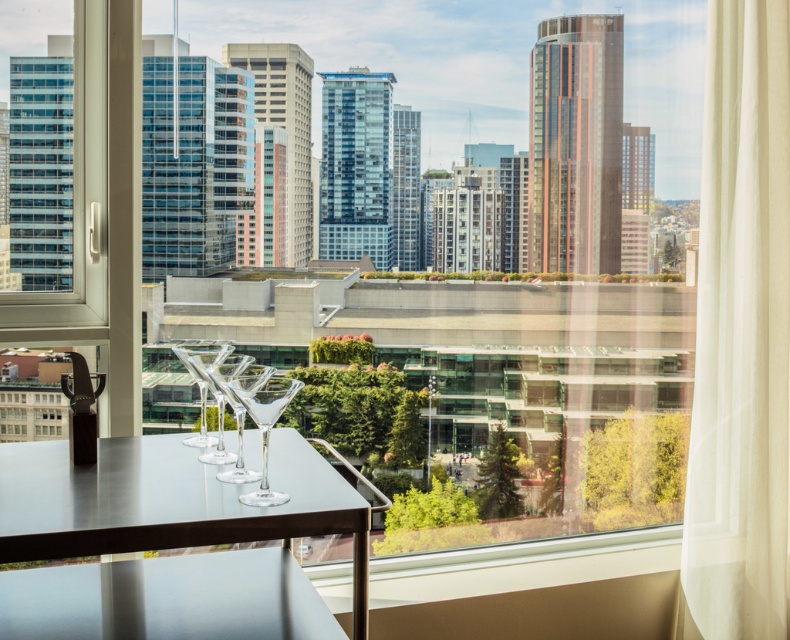
Is satin silver table at lower left bigger than transparent glass martini glass at center?

Yes, satin silver table at lower left is bigger than transparent glass martini glass at center.

Locate an element on the screen. satin silver table at lower left is located at coordinates (168, 502).

This screenshot has height=640, width=790. I want to click on satin silver table at lower left, so click(x=168, y=502).

Between satin silver table at lower left and clear glass wine glass at center, which one has more height?

With more height is satin silver table at lower left.

Find the location of a particular element. The image size is (790, 640). satin silver table at lower left is located at coordinates (168, 502).

Does point (779, 154) come farther from viewer compared to point (292, 449)?

That is True.

Does white sheer curtain at right appear over satin silver table at lower left?

Yes.

Is point (698, 582) positioned after point (47, 500)?

Yes.

Where is `white sheer curtain at right`? The height and width of the screenshot is (640, 790). white sheer curtain at right is located at coordinates (740, 333).